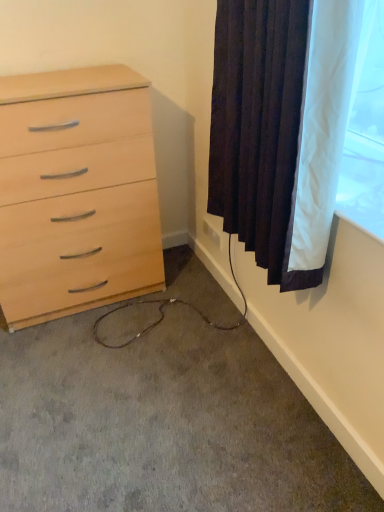
The height and width of the screenshot is (512, 384). What do you see at coordinates (162, 424) in the screenshot?
I see `carpet at lower left` at bounding box center [162, 424].

Describe the element at coordinates (212, 233) in the screenshot. The image size is (384, 512). I see `white plastic outlet at lower right` at that location.

This screenshot has width=384, height=512. Find the location of `dark fabric curtain at upper right`. dark fabric curtain at upper right is located at coordinates (281, 127).

Considering the points (139, 140) and (220, 237), which point is in front, point (139, 140) or point (220, 237)?

The point (139, 140) is more forward.

From a real-world perspective, is light wood chest of drawers at left physically below white plastic outlet at lower right?

Incorrect, from a real-world perspective, light wood chest of drawers at left is higher than white plastic outlet at lower right.

Choose the correct answer: Is light wood chest of drawers at left inside white plastic outlet at lower right or outside it?

light wood chest of drawers at left is outside white plastic outlet at lower right.

Considering the sizes of objects light wood chest of drawers at left and white plastic outlet at lower right in the image provided, who is smaller, light wood chest of drawers at left or white plastic outlet at lower right?

white plastic outlet at lower right is smaller.

Is the depth of white plastic outlet at lower right less than that of carpet at lower left?

No, it is behind carpet at lower left.

Does white plastic outlet at lower right appear on the left side of carpet at lower left?

In fact, white plastic outlet at lower right is to the right of carpet at lower left.

Find the location of a particular element. The height and width of the screenshot is (512, 384). electric outlet located above the carpet at lower left (from a real-world perspective) is located at coordinates (212, 233).

Is white plastic outlet at lower right touching carpet at lower left?

No, white plastic outlet at lower right is not making contact with carpet at lower left.

Is dark fabric curtain at upper right positioned beyond the bounds of carpet at lower left?

dark fabric curtain at upper right is positioned outside carpet at lower left.

What's the angular difference between dark fabric curtain at upper right and carpet at lower left's facing directions?

dark fabric curtain at upper right and carpet at lower left are facing 88.8 degrees away from each other.

Does point (289, 216) appear closer or farther from the camera than point (351, 485)?

Point (289, 216) is positioned closer to the camera compared to point (351, 485).

Is dark fabric curtain at upper right far away from carpet at lower left?

No.

Measure the distance between white plastic outlet at lower right and dark fabric curtain at upper right.

87.87 centimeters.

The height and width of the screenshot is (512, 384). What are the coordinates of `electric outlet on the left side of dark fabric curtain at upper right` in the screenshot? It's located at (212, 233).

Can you confirm if white plastic outlet at lower right is wider than dark fabric curtain at upper right?

No, white plastic outlet at lower right is not wider than dark fabric curtain at upper right.

From a real-world perspective, between white plastic outlet at lower right and dark fabric curtain at upper right, who is vertically lower?

In real-world perspective, white plastic outlet at lower right is lower.

In the scene shown: In terms of width, does carpet at lower left look wider or thinner when compared to white plastic outlet at lower right?

Clearly, carpet at lower left has more width compared to white plastic outlet at lower right.

Is point (51, 376) closer to camera compared to point (211, 231)?

That is True.

Considering the relative positions of carpet at lower left and white plastic outlet at lower right in the image provided, is carpet at lower left to the left of white plastic outlet at lower right from the viewer's perspective?

Yes.

Is carpet at lower left looking in the opposite direction of white plastic outlet at lower right?

carpet at lower left is not turned away from white plastic outlet at lower right.

Between white plastic outlet at lower right and light wood chest of drawers at left, which one is positioned behind?

white plastic outlet at lower right is behind.

Is white plastic outlet at lower right spatially inside light wood chest of drawers at left, or outside of it?

white plastic outlet at lower right cannot be found inside light wood chest of drawers at left.

Is white plastic outlet at lower right looking in the opposite direction of light wood chest of drawers at left?

white plastic outlet at lower right does not have its back to light wood chest of drawers at left.

Is white plastic outlet at lower right not close to light wood chest of drawers at left?

That's not correct — white plastic outlet at lower right is a little close to light wood chest of drawers at left.

Is the surface of dark fabric curtain at upper right in direct contact with white plastic outlet at lower right?

They are not placed beside each other.

Between dark fabric curtain at upper right and white plastic outlet at lower right, which one has more height?

dark fabric curtain at upper right.

Which is nearer, (278, 173) or (206, 227)?

Clearly, point (278, 173) is closer to the camera than point (206, 227).

The width and height of the screenshot is (384, 512). Find the location of `the chest of drawers in front of the white plastic outlet at lower right`. the chest of drawers in front of the white plastic outlet at lower right is located at coordinates (75, 190).

There is a carpet at lower left. Find the location of `electric outlet above it (from a real-world perspective)`. electric outlet above it (from a real-world perspective) is located at coordinates (212, 233).

Which object lies further to the anchor point dark fabric curtain at upper right, white plastic outlet at lower right or carpet at lower left?

white plastic outlet at lower right lies further to dark fabric curtain at upper right than the other object.

Estimate the real-world distances between objects in this image. Which object is closer to white plastic outlet at lower right, dark fabric curtain at upper right or light wood chest of drawers at left?

light wood chest of drawers at left lies closer to white plastic outlet at lower right than the other object.

Which object lies further to the anchor point carpet at lower left, dark fabric curtain at upper right or light wood chest of drawers at left?

dark fabric curtain at upper right lies further to carpet at lower left than the other object.

Based on the photo, when comparing their distances from light wood chest of drawers at left, does dark fabric curtain at upper right or carpet at lower left seem further?

dark fabric curtain at upper right lies further to light wood chest of drawers at left than the other object.

Consider the image. From the image, which object appears to be nearer to white plastic outlet at lower right, light wood chest of drawers at left or carpet at lower left?

light wood chest of drawers at left lies closer to white plastic outlet at lower right than the other object.

From the image, which object appears to be nearer to white plastic outlet at lower right, carpet at lower left or light wood chest of drawers at left?

light wood chest of drawers at left lies closer to white plastic outlet at lower right than the other object.

Looking at the image, which one is located further to carpet at lower left, light wood chest of drawers at left or white plastic outlet at lower right?

white plastic outlet at lower right is further to carpet at lower left.

Looking at this image, from the image, which object appears to be farther from dark fabric curtain at upper right, white plastic outlet at lower right or light wood chest of drawers at left?

The object further to dark fabric curtain at upper right is white plastic outlet at lower right.

I want to click on chest of drawers between carpet at lower left and white plastic outlet at lower right along the z-axis, so click(x=75, y=190).

The width and height of the screenshot is (384, 512). I want to click on chest of drawers between dark fabric curtain at upper right and white plastic outlet at lower right from front to back, so click(75, 190).

This screenshot has height=512, width=384. In order to click on chest of drawers between dark fabric curtain at upper right and carpet at lower left in the up-down direction in this screenshot , I will do click(75, 190).

Image resolution: width=384 pixels, height=512 pixels. I want to click on concrete between dark fabric curtain at upper right and white plastic outlet at lower right along the z-axis, so 162,424.